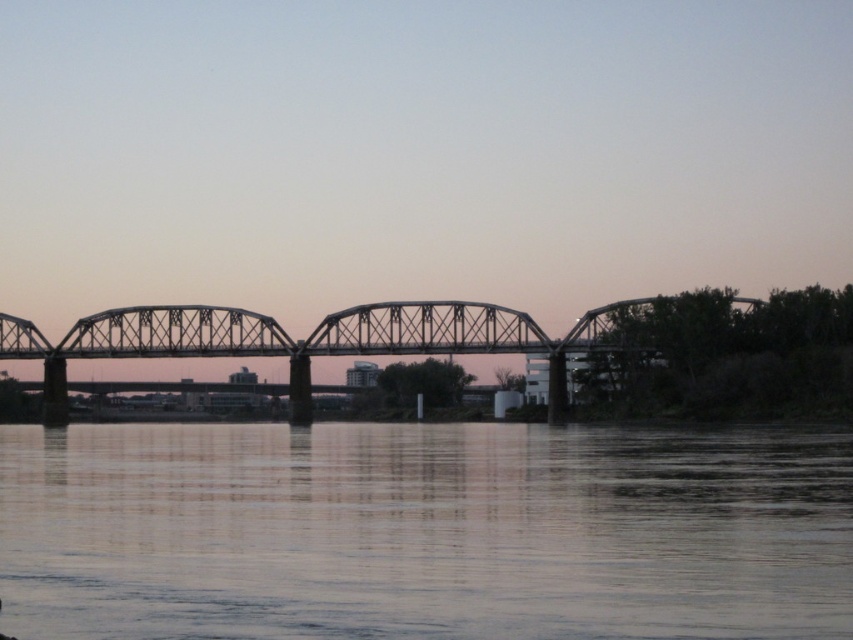
Does smooth water at center appear over metallic bridge at center?

Incorrect, smooth water at center is not positioned above metallic bridge at center.

Describe the element at coordinates (422, 531) in the screenshot. I see `smooth water at center` at that location.

At what (x,y) coordinates should I click in order to perform the action: click on smooth water at center. Please return your answer as a coordinate pair (x, y). This screenshot has width=853, height=640. Looking at the image, I should click on (422, 531).